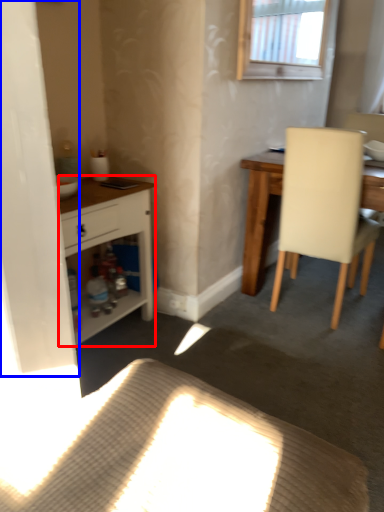
Question: Which object is closer to the camera taking this photo, cabinetry (highlighted by a red box) or screen door (highlighted by a blue box)?

Choices:
 (A) cabinetry
 (B) screen door

Answer: (B)